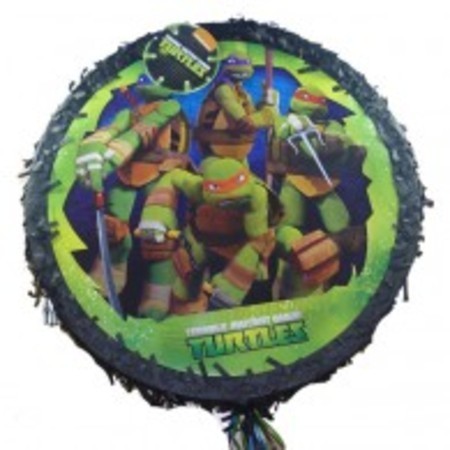
This screenshot has height=450, width=450. In order to click on padding in this screenshot , I will do `click(325, 252)`, `click(245, 284)`, `click(167, 201)`, `click(118, 239)`, `click(147, 166)`, `click(230, 144)`, `click(198, 266)`.